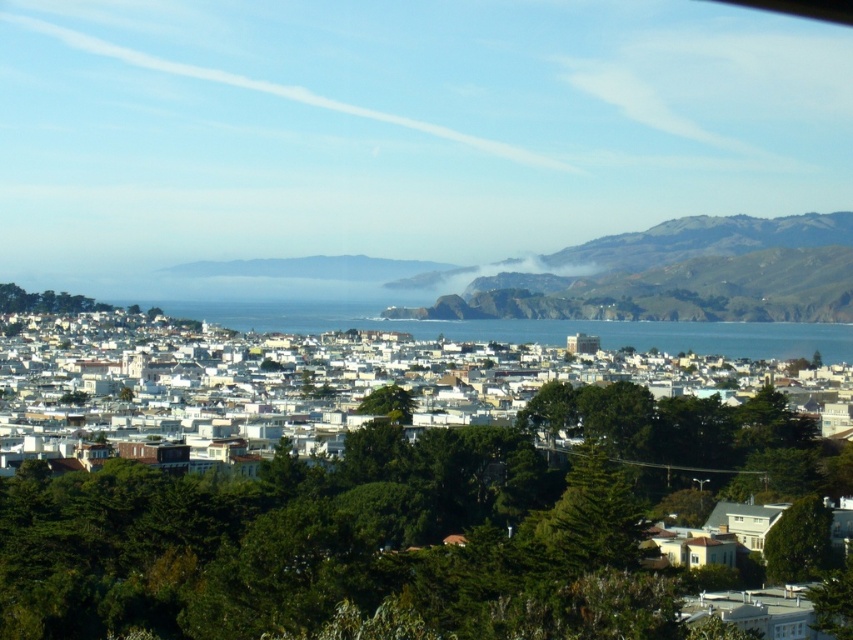
Question: Which point is closer to the camera taking this photo?

Choices:
 (A) (819, 330)
 (B) (640, 396)

Answer: (B)

Question: Is the position of white matte buildings at center less distant than that of blue water at center?

Choices:
 (A) no
 (B) yes

Answer: (B)

Question: Among these points, which one is nearest to the camera?

Choices:
 (A) (222, 368)
 (B) (793, 340)

Answer: (A)

Question: Is white matte buildings at center behind blue water at center?

Choices:
 (A) yes
 (B) no

Answer: (B)

Question: Does white matte buildings at center have a greater width compared to blue water at center?

Choices:
 (A) no
 (B) yes

Answer: (B)

Question: Among these objects, which one is nearest to the camera?

Choices:
 (A) white matte buildings at center
 (B) blue water at center

Answer: (A)